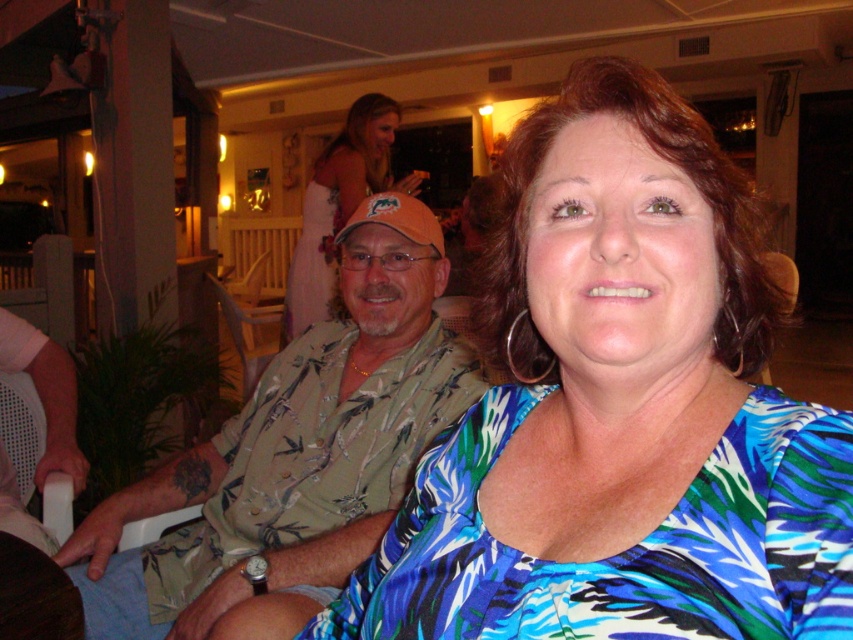
You are a photographer at the event and want to capture a photo of the blue printed blouse at center and the matte orange cap at center. Which object is positioned lower in the frame?

The blue printed blouse at center is located below the matte orange cap at center, so it is positioned lower in the frame.

What is the main color of the clothing item located at the coordinates point [619,410]?

The main color of the clothing item at point [619,410] is blue.